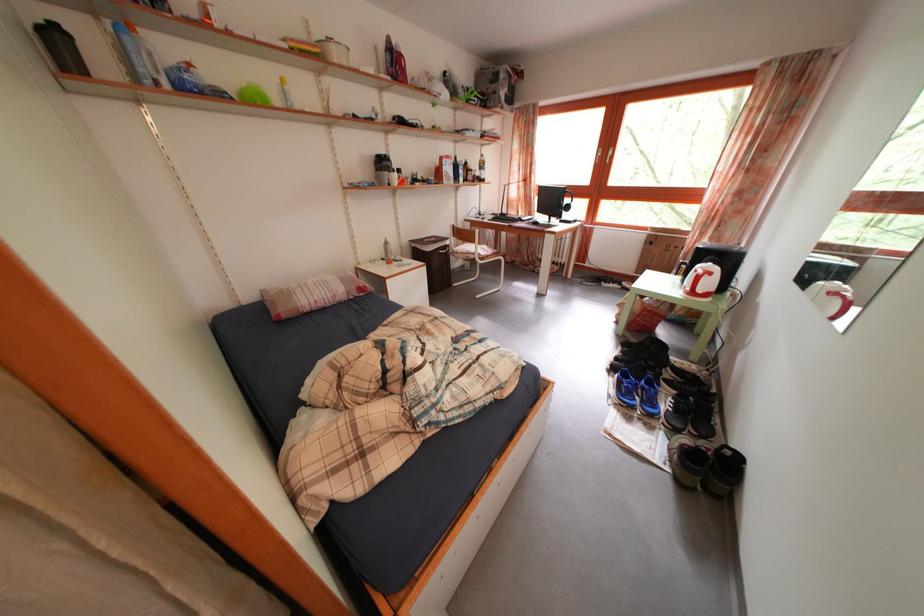
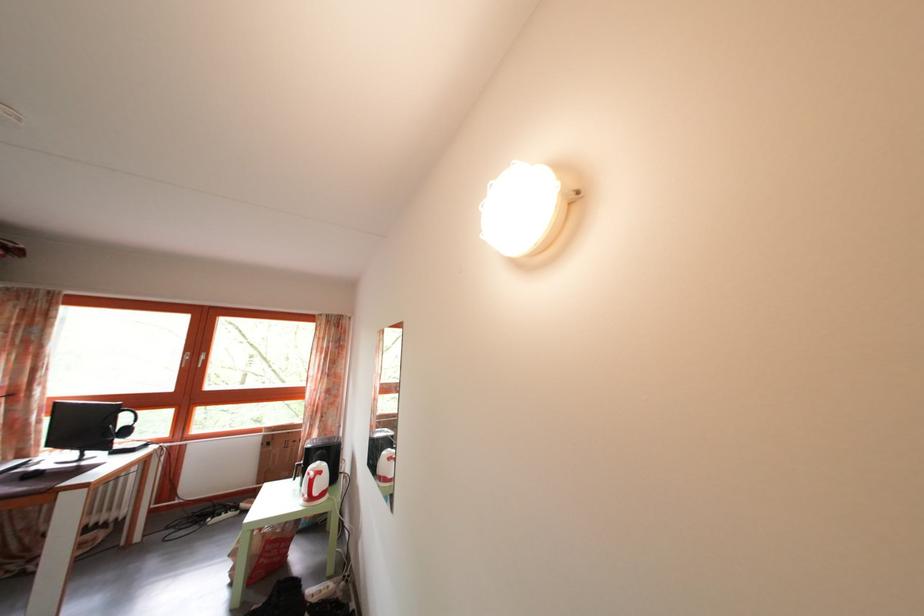
The point at (x=718, y=281) is marked in the first image. Where is the corresponding point in the second image?

(327, 480)